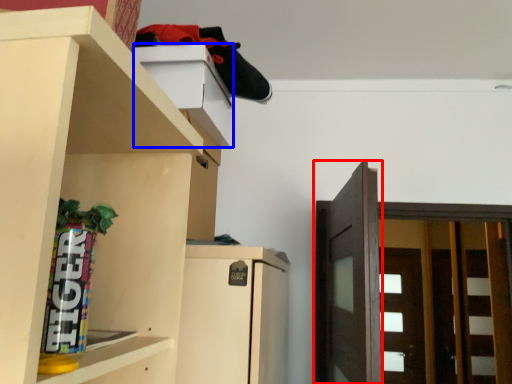
Question: Among these objects, which one is farthest to the camera, door (highlighted by a red box) or cabinet (highlighted by a blue box)?

Choices:
 (A) door
 (B) cabinet

Answer: (A)